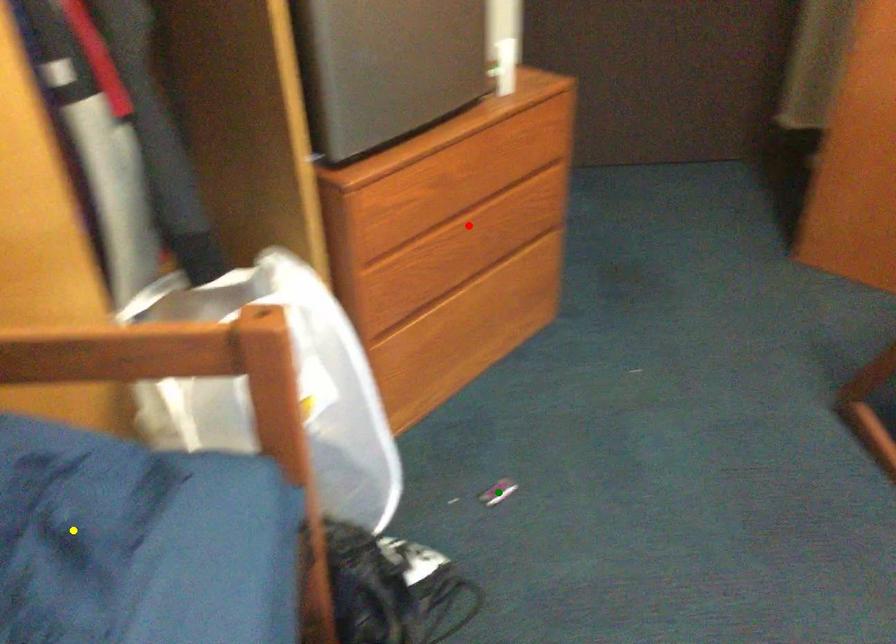
Order these from nearest to farthest:
red point | yellow point | green point

green point < red point < yellow point